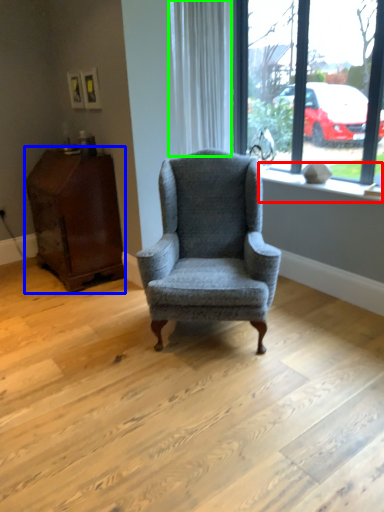
Question: Which object is positioned farthest from window sill (highlighted by a red box)? Select from table (highlighted by a blue box) and curtain (highlighted by a green box).

Choices:
 (A) table
 (B) curtain

Answer: (A)